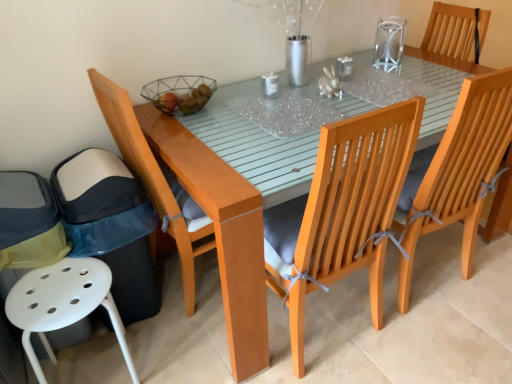
The image size is (512, 384). Identify the location of free space in front of transparent plastic table at center, the second glass table viewed from the right. (257, 150).